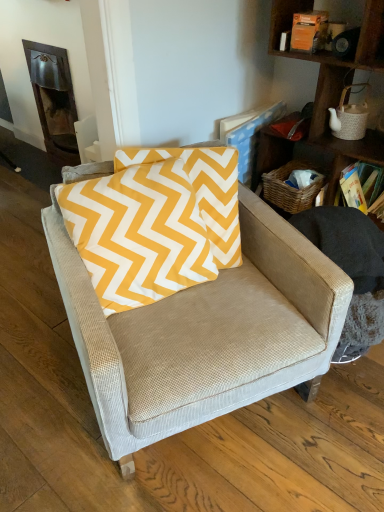
Question: Can you confirm if woven wood shelf at upper right is smaller than hardcover book at upper right?

Choices:
 (A) yes
 (B) no

Answer: (B)

Question: Is the depth of woven wood shelf at upper right greater than that of hardcover book at upper right?

Choices:
 (A) no
 (B) yes

Answer: (A)

Question: Can you confirm if woven wood shelf at upper right is thinner than hardcover book at upper right?

Choices:
 (A) yes
 (B) no

Answer: (B)

Question: Would you consider woven wood shelf at upper right to be distant from hardcover book at upper right?

Choices:
 (A) no
 (B) yes

Answer: (A)

Question: From the image's perspective, is woven wood shelf at upper right under hardcover book at upper right?

Choices:
 (A) yes
 (B) no

Answer: (B)

Question: Is woven wood shelf at upper right oriented away from hardcover book at upper right?

Choices:
 (A) yes
 (B) no

Answer: (A)

Question: Considering the relative sizes of hardcover book at upper right and yellow cotton pillow at center in the image provided, is hardcover book at upper right smaller than yellow cotton pillow at center?

Choices:
 (A) no
 (B) yes

Answer: (B)

Question: From the image's perspective, is hardcover book at upper right on top of yellow cotton pillow at center?

Choices:
 (A) yes
 (B) no

Answer: (A)

Question: Considering the relative positions of hardcover book at upper right and yellow cotton pillow at center in the image provided, is hardcover book at upper right behind yellow cotton pillow at center?

Choices:
 (A) yes
 (B) no

Answer: (A)

Question: Does hardcover book at upper right have a greater width compared to yellow cotton pillow at center?

Choices:
 (A) no
 (B) yes

Answer: (B)

Question: Is hardcover book at upper right shorter than yellow cotton pillow at center?

Choices:
 (A) no
 (B) yes

Answer: (B)

Question: Is hardcover book at upper right facing away from yellow cotton pillow at center?

Choices:
 (A) yes
 (B) no

Answer: (B)

Question: Is yellow cotton pillow at center surrounding beige fabric chair at center?

Choices:
 (A) yes
 (B) no

Answer: (B)